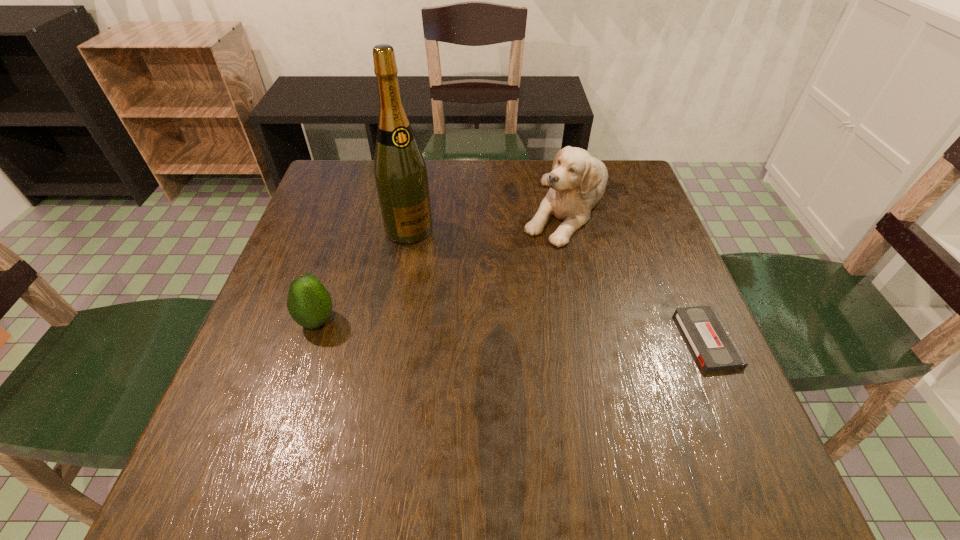
Identify the location of free point located 0.150m on the front-facing side of the wine bottle. (449, 281).

Identify the location of vacant region located 0.150m on the front-facing side of the wine bottle. The height and width of the screenshot is (540, 960). (x=449, y=281).

Where is `vacant space located on the front-facing side of the wine bottle`? This screenshot has width=960, height=540. vacant space located on the front-facing side of the wine bottle is located at coordinates (460, 295).

Identify the location of free point located 0.050m on the front-facing side of the third object from left to right. The height and width of the screenshot is (540, 960). (553, 259).

Where is `vacant space located 0.390m on the front-facing side of the third object from left to right`? The height and width of the screenshot is (540, 960). vacant space located 0.390m on the front-facing side of the third object from left to right is located at coordinates (510, 377).

At what (x,y) coordinates should I click in order to perform the action: click on blank space located 0.360m on the front-facing side of the third object from left to right. Please return your answer as a coordinate pair (x, y). Looking at the image, I should click on (515, 364).

Locate an element on the screen. The height and width of the screenshot is (540, 960). object that is positioned at the far edge is located at coordinates (577, 182).

Locate an element on the screen. Image resolution: width=960 pixels, height=540 pixels. object that is at the left edge is located at coordinates (309, 303).

Where is `videotape present at the right edge`? The height and width of the screenshot is (540, 960). videotape present at the right edge is located at coordinates (714, 347).

This screenshot has width=960, height=540. In order to click on puppy that is at the right edge in this screenshot , I will do `click(577, 182)`.